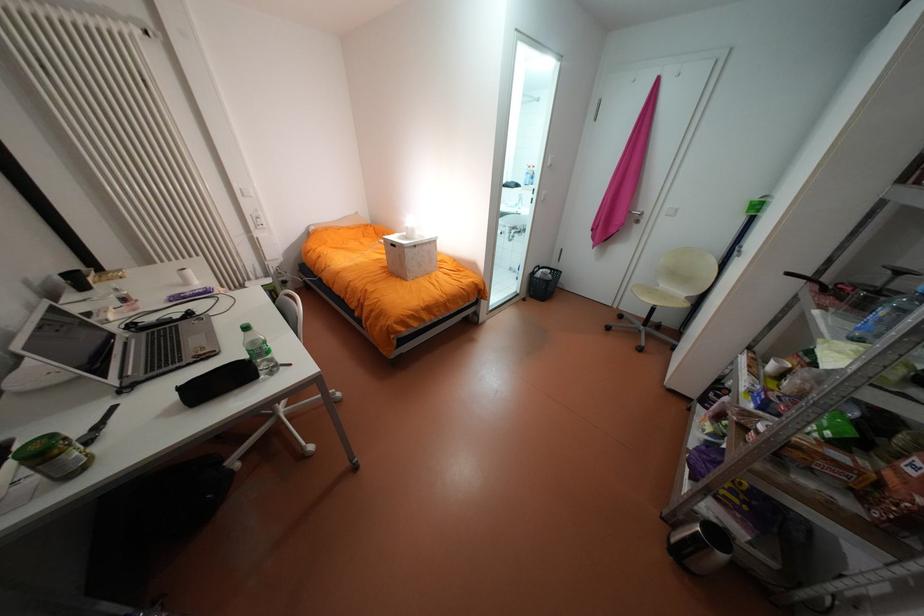
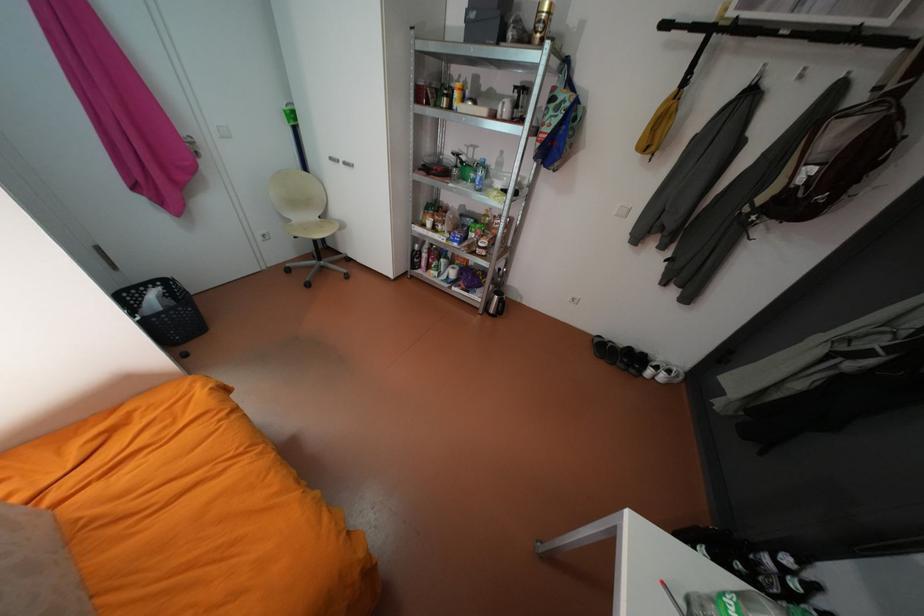
Find the pixel in the second image that matches (x=714, y=400) in the first image.

(423, 265)